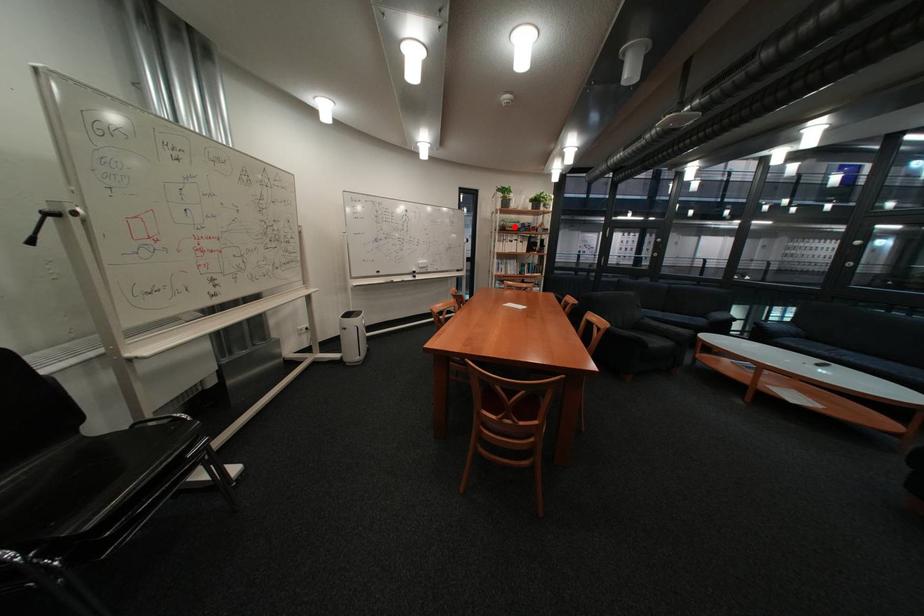
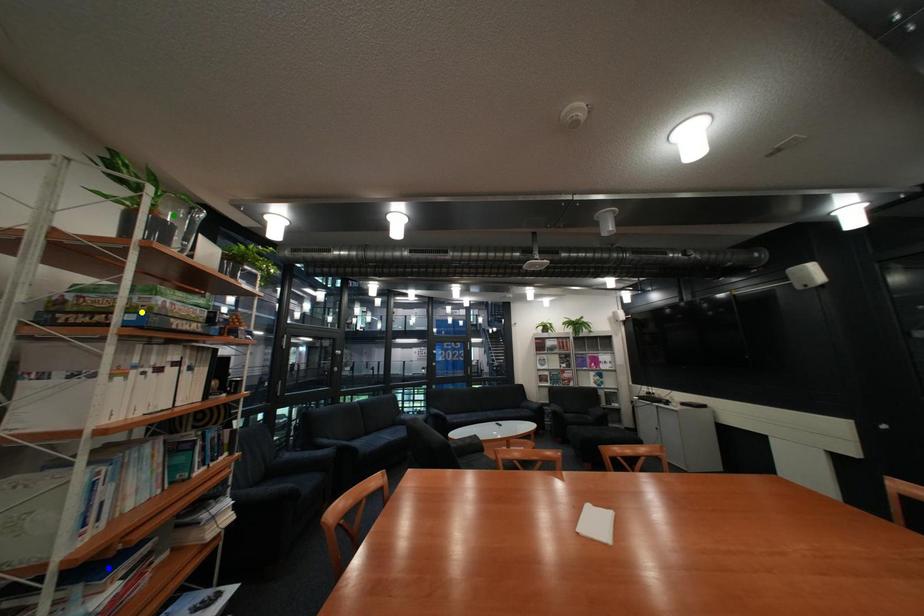
Question: I am providing you with two images of the same scene from different viewpoints. A red point is marked on the first image. You are given multiple points on the second image. Which point in image 2 is actually the same real-world point as the red point in image 1?

Choices:
 (A) green point
 (B) blue point
 (C) yellow point

Answer: (C)